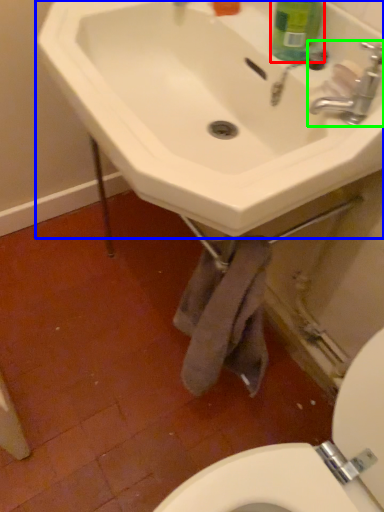
Question: Which object is positioned farthest from cleaning product (highlighted by a red box)? Select from sink (highlighted by a blue box) and tap (highlighted by a green box).

Choices:
 (A) sink
 (B) tap

Answer: (A)